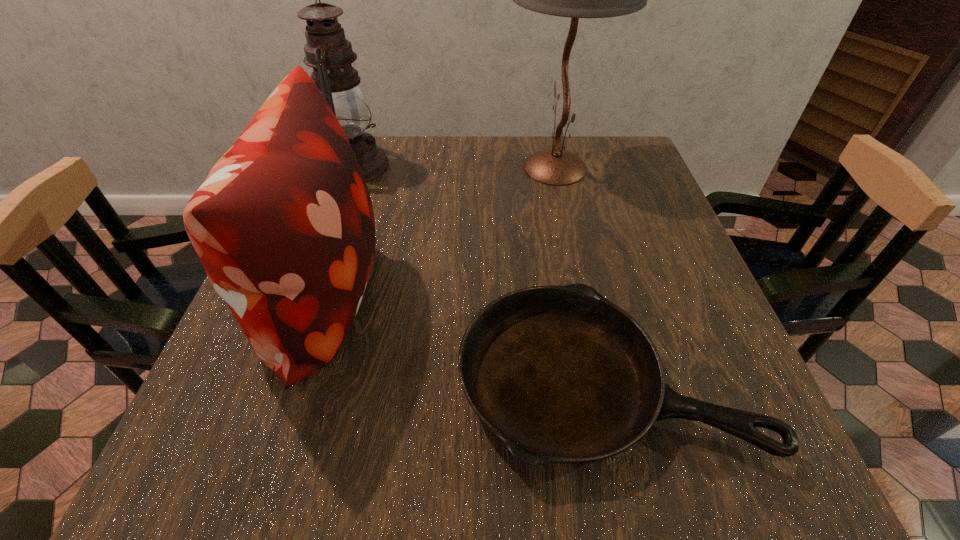
Where is `unoccupied area between the oil lamp and the frying pan`? The height and width of the screenshot is (540, 960). unoccupied area between the oil lamp and the frying pan is located at coordinates (479, 273).

This screenshot has width=960, height=540. Identify the location of vacant area that lies between the cushion and the frying pan. (462, 339).

Image resolution: width=960 pixels, height=540 pixels. I want to click on vacant space that is in between the shortest object and the oil lamp, so click(x=479, y=273).

Locate which object ranks in proximity to the cushion. Please provide its 2D coordinates. Your answer should be formatted as a tuple, i.e. [(x, y)], where the tuple contains the x and y coordinates of a point satisfying the conditions above.

[(560, 374)]

This screenshot has width=960, height=540. Find the location of `object that can be found as the third closest to the tallest object`. object that can be found as the third closest to the tallest object is located at coordinates (560, 374).

Where is `vacant area in the image that satisfies the following two spatial constraints: 1. on the front-facing side of the table lamp; 2. on the right side of the shortest object`? The width and height of the screenshot is (960, 540). vacant area in the image that satisfies the following two spatial constraints: 1. on the front-facing side of the table lamp; 2. on the right side of the shortest object is located at coordinates (601, 380).

Locate an element on the screen. The height and width of the screenshot is (540, 960). free space that satisfies the following two spatial constraints: 1. on the front-facing side of the shortest object; 2. on the left side of the cushion is located at coordinates (295, 380).

Locate an element on the screen. vacant point that satisfies the following two spatial constraints: 1. on the front-facing side of the frying pan; 2. on the right side of the tallest object is located at coordinates (601, 380).

Find the location of a particular element. The image size is (960, 540). free spot that satisfies the following two spatial constraints: 1. on the front-facing side of the frying pan; 2. on the right side of the table lamp is located at coordinates coord(601,380).